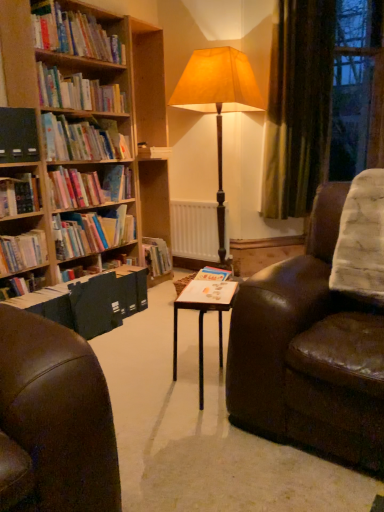
Question: Do you think dark green velvet curtain at upper right is within black matte book at left, which ranks as the first paperback book in left-to-right order, or outside of it?

Choices:
 (A) inside
 (B) outside

Answer: (B)

Question: In terms of height, does dark green velvet curtain at upper right look taller or shorter compared to black matte book at left, which ranks as the first paperback book in back-to-front order?

Choices:
 (A) tall
 (B) short

Answer: (A)

Question: Which object is the closest to the hardcover books at left, marked as the fourth book in a bottom-to-top arrangement?

Choices:
 (A) dark green velvet curtain at upper right
 (B) hardcover book at left, placed as the third book when sorted from bottom to top
 (C) matte paper at center, which appears as the first paperback book when ordered from the bottom
 (D) hardcover books at upper left, which is the sixth book from bottom to top
 (E) hardcover book at upper left, placed as the third book when sorted from top to bottom

Answer: (E)

Question: Estimate the real-world distances between objects in this image. Which object is closer to the white wooden table at center?

Choices:
 (A) dark green velvet curtain at upper right
 (B) hardcover book at upper left, placed as the third book when sorted from top to bottom
 (C) hardcover books at upper left, the 2th book from the top
 (D) hardcover book at left, acting as the 7th book starting from the top
 (E) hardcover books at upper left, positioned as the 1th book in top-to-bottom order

Answer: (D)